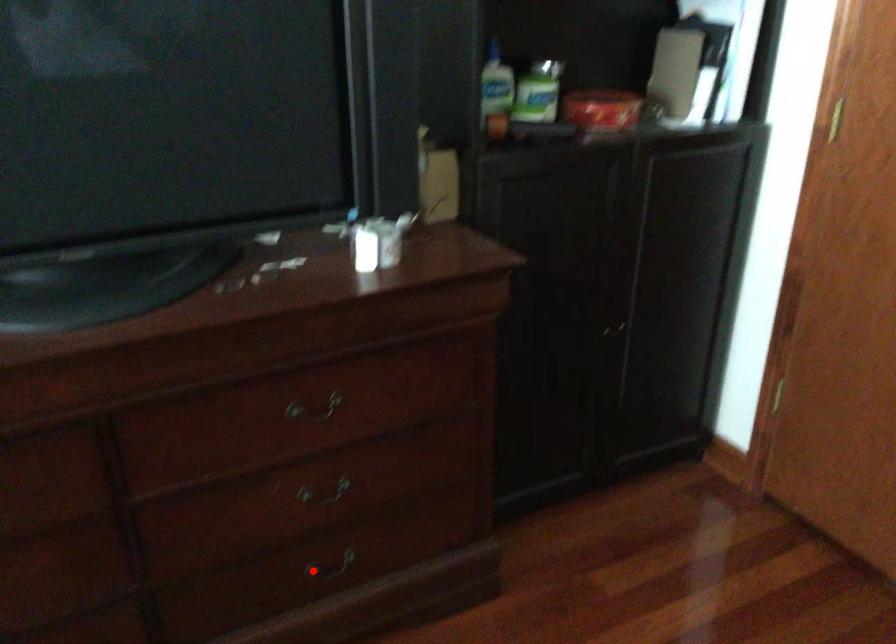
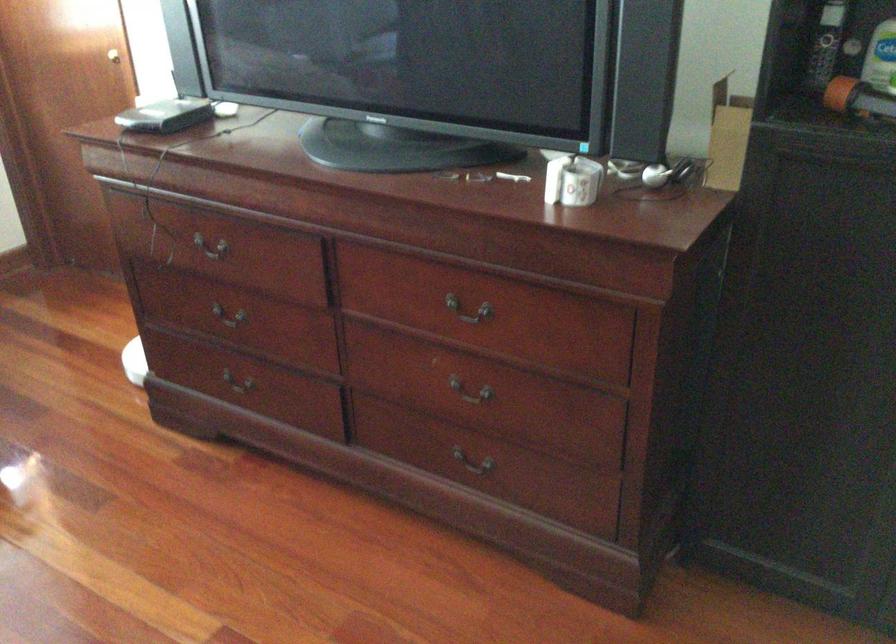
Question: I am providing you with two images of the same scene from different viewpoints. In image1, a red point is highlighted. Considering the same 3D point in image2, which of the following is correct?

Choices:
 (A) It is closer
 (B) It is farther

Answer: (B)